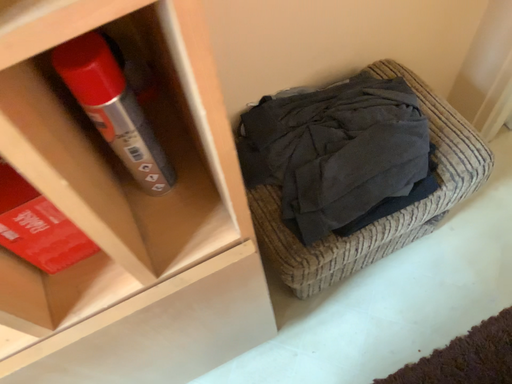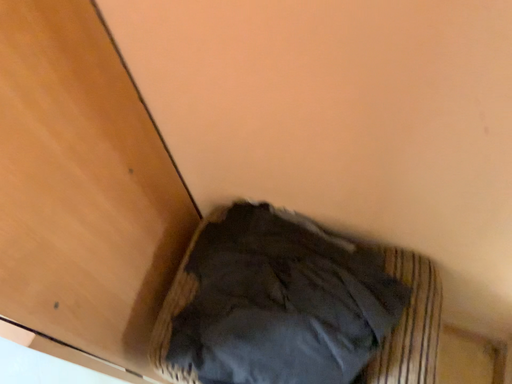
Question: How did the camera likely rotate when shooting the video?

Choices:
 (A) rotated right
 (B) rotated left

Answer: (B)